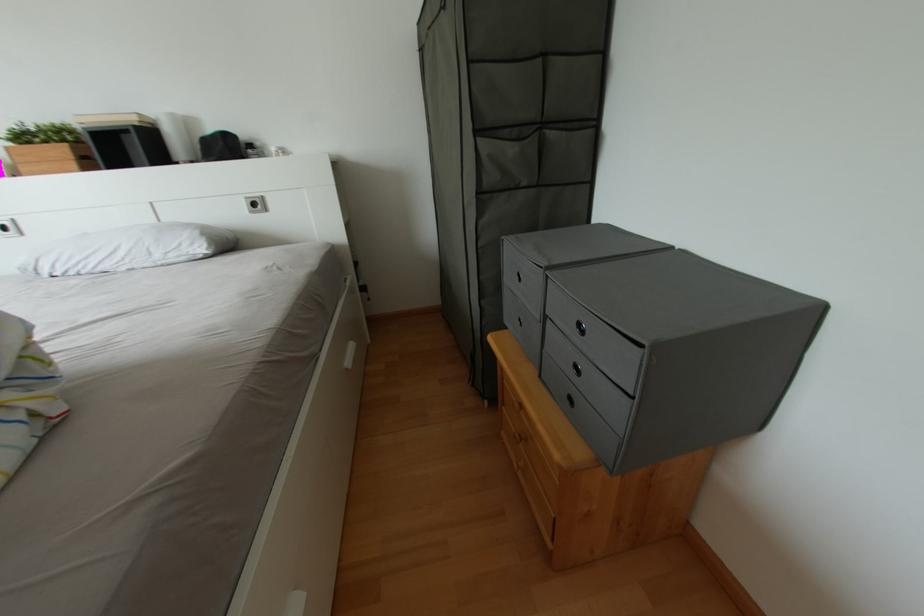
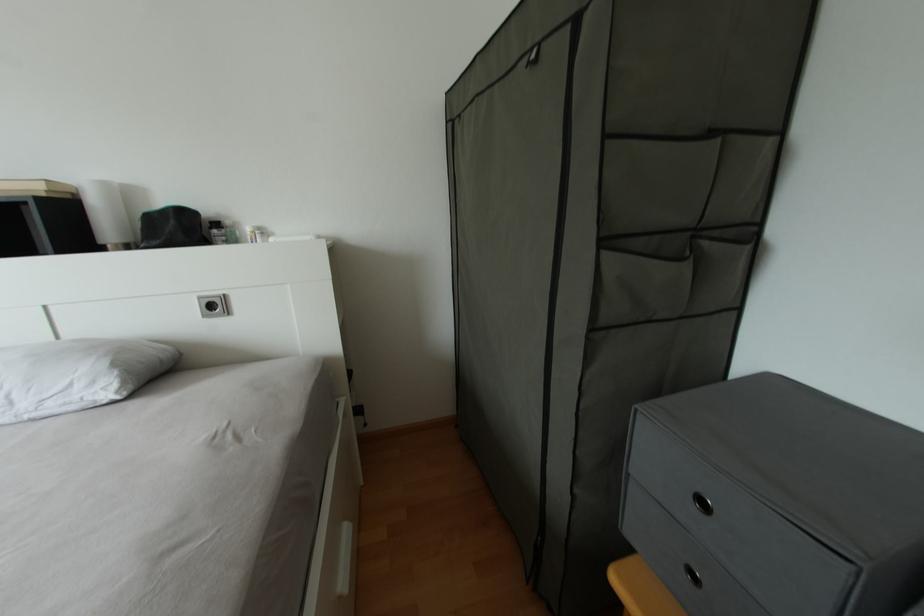
Question: Based on the continuous images, in which direction is the camera rotating? Reply with the corresponding letter.

Choices:
 (A) Left
 (B) Right
 (C) Up
 (D) Down

Answer: (C)